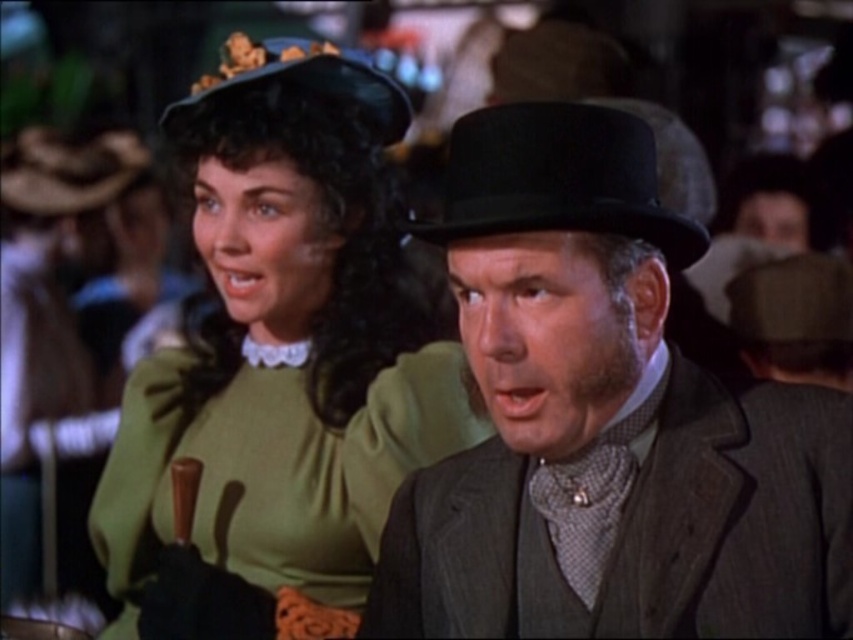
Is matte black hat at center taller than black felt fedora at center?

Indeed, matte black hat at center has a greater height compared to black felt fedora at center.

Is matte black hat at center smaller than black felt fedora at center?

No.

This screenshot has height=640, width=853. Describe the element at coordinates (605, 416) in the screenshot. I see `matte black hat at center` at that location.

You are a GUI agent. You are given a task and a screenshot of the screen. Output one action in this format:
    pyautogui.click(x=<x>, y=<y>)
    Task: Click on the matte black hat at center
    Image resolution: width=853 pixels, height=640 pixels.
    Given the screenshot: What is the action you would take?
    pyautogui.click(x=605, y=416)

Does matte black hat at center appear on the right side of velvet black hat at upper left?

Yes, matte black hat at center is to the right of velvet black hat at upper left.

Measure the distance between matte black hat at center and camera.

matte black hat at center and camera are 4.63 feet apart.

Does point (819, 602) come behind point (323, 84)?

No, it is not.

You are a GUI agent. You are given a task and a screenshot of the screen. Output one action in this format:
    pyautogui.click(x=<x>, y=<y>)
    Task: Click on the matte black hat at center
    This screenshot has width=853, height=640.
    Given the screenshot: What is the action you would take?
    pyautogui.click(x=605, y=416)

Is green velvet dress at upper left further to camera compared to velvet black hat at upper left?

No, green velvet dress at upper left is closer to the viewer.

Describe the element at coordinates (280, 352) in the screenshot. The width and height of the screenshot is (853, 640). I see `green velvet dress at upper left` at that location.

Find the location of a particular element. green velvet dress at upper left is located at coordinates (280, 352).